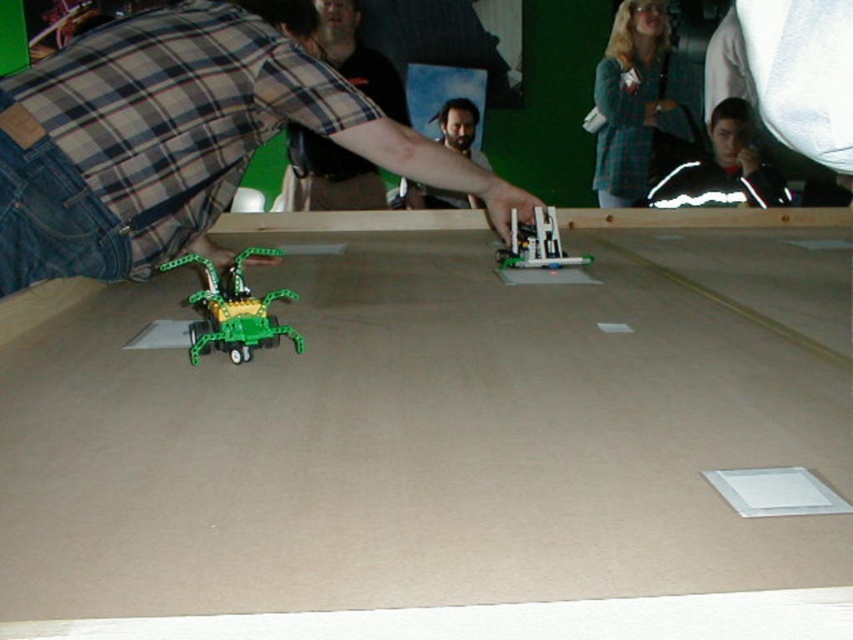
Consider the image. You are organizing a small exhibition and need to arrange items on a display table. You have a black fleece jacket at upper right and a green plastic toy at lower left. From the visitor standing in front of the table, which item is closer to the front of the table?

The black fleece jacket at upper right is closer to the front of the table because the green plastic toy at lower left is positioned behind it.

You are a participant in a robotics competition and need to locate your team member wearing a green plaid shirt at upper center. Where should you look on the image to find them?

The green plaid shirt at upper center is located at point coordinates of (640, 102).